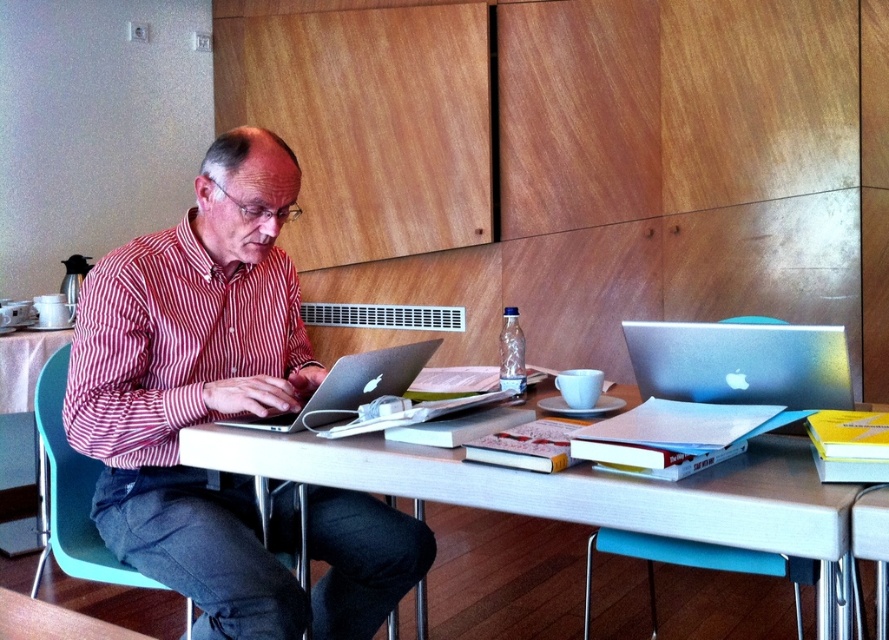
Is white matte table at center positioned at the back of red striped shirt at left?

No, it is not.

Describe the element at coordinates (567, 486) in the screenshot. This screenshot has width=889, height=640. I see `white matte table at center` at that location.

This screenshot has width=889, height=640. I want to click on white matte table at center, so click(x=567, y=486).

Which is more to the left, white matte table at center or satin silver laptop at upper right?

Positioned to the left is white matte table at center.

Who is positioned more to the right, white matte table at center or satin silver laptop at upper right?

satin silver laptop at upper right is more to the right.

Between point (575, 488) and point (694, 371), which one is positioned in front?

Point (575, 488)

Where is `white matte table at center`? The image size is (889, 640). white matte table at center is located at coordinates (567, 486).

Measure the distance between satin silver laptop at upper right and silver metallic laptop at center.

satin silver laptop at upper right is 56.45 centimeters away from silver metallic laptop at center.

Who is taller, satin silver laptop at upper right or silver metallic laptop at center?

Standing taller between the two is satin silver laptop at upper right.

Is point (682, 381) positioned before point (411, 360)?

Yes, point (682, 381) is in front of point (411, 360).

The width and height of the screenshot is (889, 640). What are the coordinates of `satin silver laptop at upper right` in the screenshot? It's located at (741, 362).